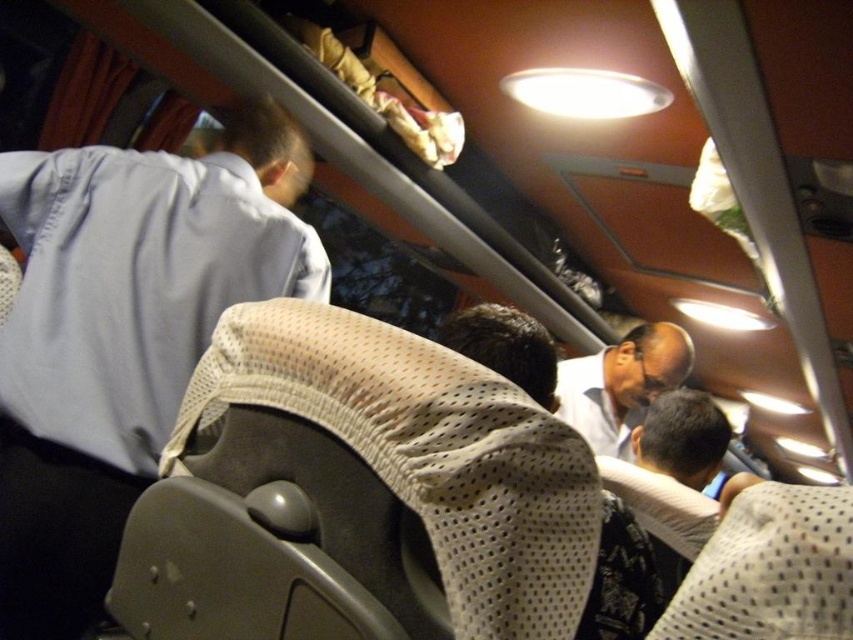
This screenshot has width=853, height=640. What are the coordinates of `light blue fabric shirt at upper left` in the screenshot? It's located at (123, 333).

Who is lower down, light blue fabric shirt at upper left or white shirt at center?

Positioned lower is white shirt at center.

Is point (106, 291) more distant than point (631, 422)?

That is False.

The image size is (853, 640). In order to click on light blue fabric shirt at upper left in this screenshot , I will do `click(123, 333)`.